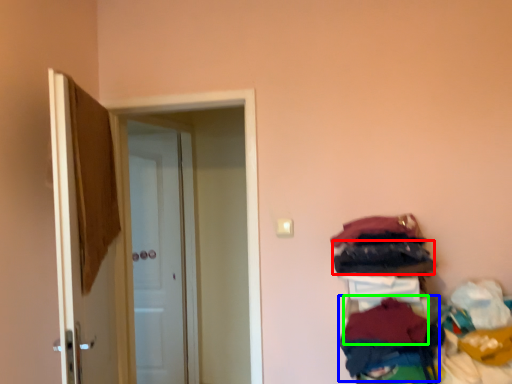
Question: Estimate the real-world distances between objects in this image. Which object is closer to clothing (highlighted by a red box), clothing (highlighted by a blue box) or clothing (highlighted by a green box)?

Choices:
 (A) clothing
 (B) clothing

Answer: (B)